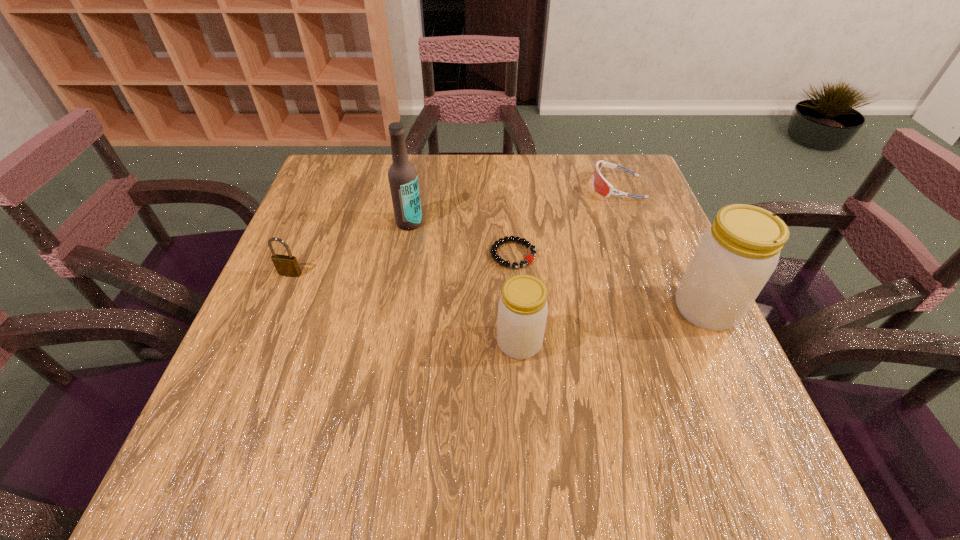
Locate an element on the screen. This screenshot has width=960, height=540. object that is at the left edge is located at coordinates (285, 265).

I want to click on jar at the right edge, so click(734, 258).

Locate an element on the screen. goggles positioned at the right edge is located at coordinates (600, 184).

Identify the location of object positioned at the far right corner. The height and width of the screenshot is (540, 960). click(x=600, y=184).

Identify the location of free space at the far edge of the desktop. This screenshot has width=960, height=540. (547, 165).

Find the location of a particular element. This screenshot has height=540, width=960. vacant region at the near edge of the desktop is located at coordinates (405, 422).

In the image, there is a desktop. Identify the location of vacant space at the left edge. (314, 331).

Identify the location of vacant area at the right edge of the desktop. point(656,213).

I want to click on free region at the far left corner of the desktop, so click(339, 162).

You are a GUI agent. You are given a task and a screenshot of the screen. Output one action in this format:
    pyautogui.click(x=<x>, y=<y>)
    Task: Click on the vacant area at the near right corner
    The height and width of the screenshot is (540, 960).
    Given the screenshot: What is the action you would take?
    pyautogui.click(x=741, y=408)